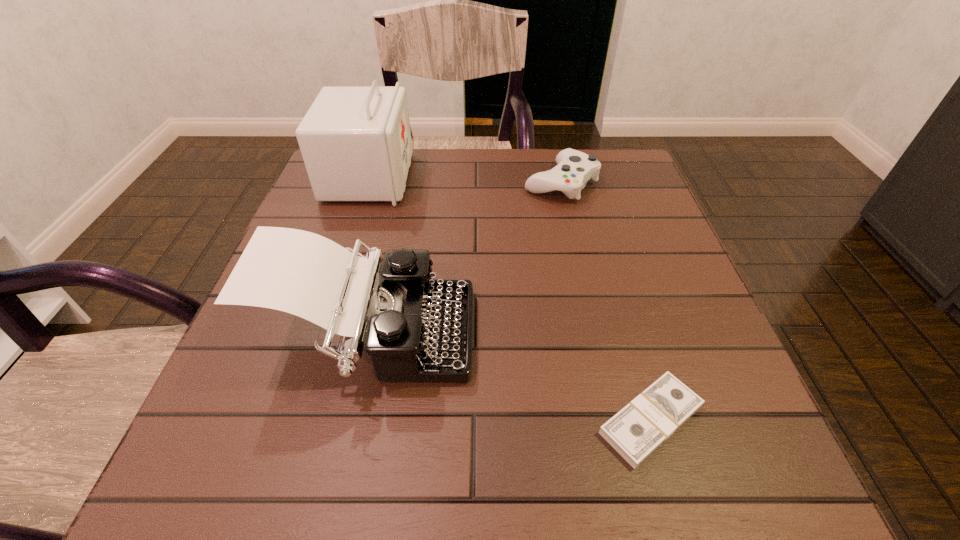
The height and width of the screenshot is (540, 960). In order to click on the first-aid kit in this screenshot , I will do `click(356, 144)`.

You are a GUI agent. You are given a task and a screenshot of the screen. Output one action in this format:
    pyautogui.click(x=<x>, y=<y>)
    Task: Click on the third shortest object
    The height and width of the screenshot is (540, 960).
    Given the screenshot: What is the action you would take?
    pyautogui.click(x=415, y=328)

At what (x,y) coordinates should I click in order to perform the action: click on control. Please return your answer as a coordinate pair (x, y). The height and width of the screenshot is (540, 960). Looking at the image, I should click on (574, 168).

Locate an element on the screen. dollar is located at coordinates (638, 429).

At what (x,y) coordinates should I click in order to perform the action: click on vacant space located 0.060m on the front-facing side of the tallest object. Please return your answer as a coordinate pair (x, y). The height and width of the screenshot is (540, 960). Looking at the image, I should click on (433, 178).

I want to click on vacant area situated on the keys of the typewriter, so click(x=672, y=337).

This screenshot has height=540, width=960. Find the location of `free point located 0.230m on the front of the second shortest object`. free point located 0.230m on the front of the second shortest object is located at coordinates (582, 275).

What are the coordinates of `vacant space located on the back of the shortest object` in the screenshot? It's located at (611, 282).

Where is `the first-aid kit that is at the far edge`? This screenshot has width=960, height=540. the first-aid kit that is at the far edge is located at coordinates (356, 144).

I want to click on control present at the far edge, so click(x=574, y=168).